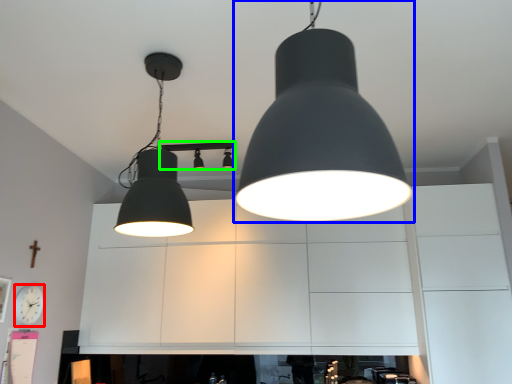
Question: Considering the real-world distances, which object is closest to clock (highlighted by a red box)? lamp (highlighted by a blue box) or lamp (highlighted by a green box).

Choices:
 (A) lamp
 (B) lamp

Answer: (B)